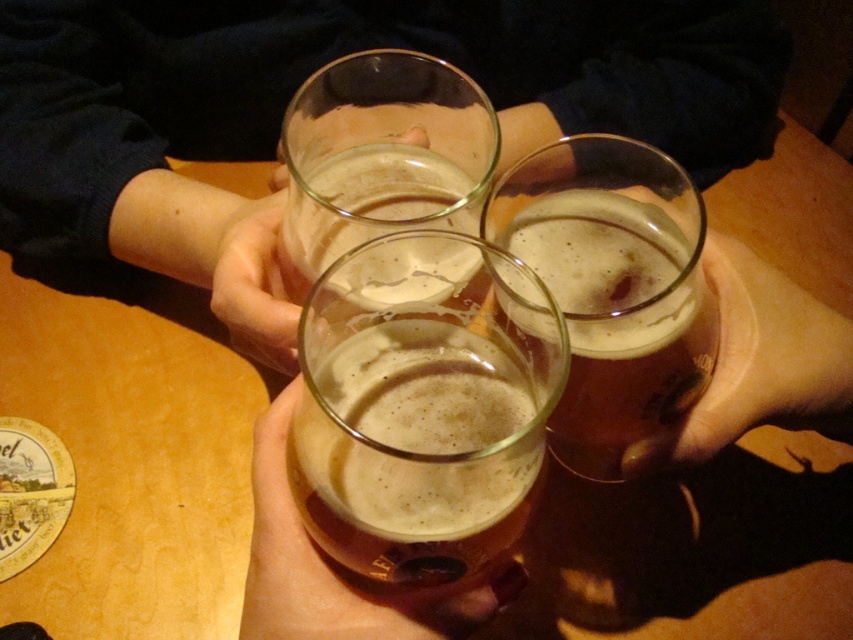
Who is taller, clear glass beer at center or translucent glass at center?

With more height is clear glass beer at center.

Between clear glass beer at center and translucent glass at center, which one appears on the left side from the viewer's perspective?

translucent glass at center is more to the left.

I want to click on clear glass beer at center, so click(x=299, y=83).

Between translucent glass beer at center and translucent glass at center, which one has more height?

Standing taller between the two is translucent glass at center.

Is point (526, 483) more distant than point (315, 81)?

No, (526, 483) is closer to viewer.

This screenshot has width=853, height=640. What do you see at coordinates (416, 449) in the screenshot? I see `translucent glass beer at center` at bounding box center [416, 449].

Where is `translucent glass beer at center`? translucent glass beer at center is located at coordinates (416, 449).

The width and height of the screenshot is (853, 640). Describe the element at coordinates (416, 449) in the screenshot. I see `translucent glass beer at center` at that location.

Find the location of a particular element. translucent glass beer at center is located at coordinates tap(416, 449).